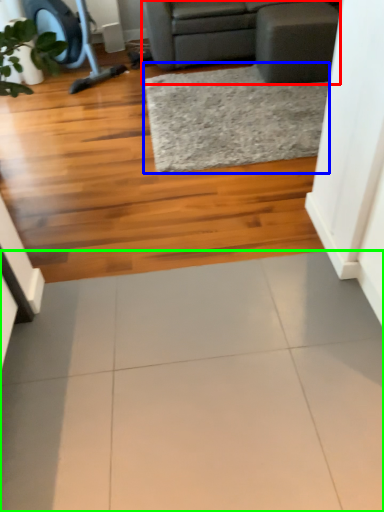
Question: Based on their relative distances, which object is nearer to studio couch (highlighted by a red box)? Choose from mat (highlighted by a blue box) and ceramic tile (highlighted by a green box).

Choices:
 (A) mat
 (B) ceramic tile

Answer: (A)